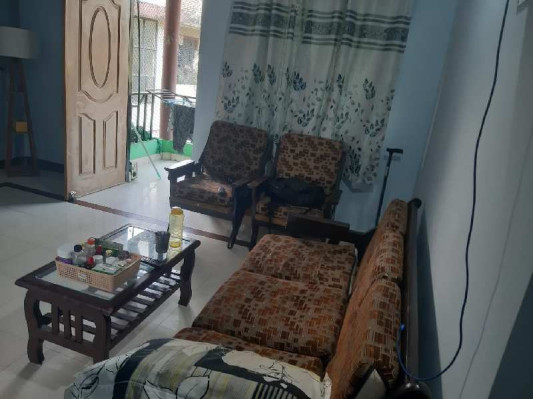
Locate an element on the screen. Image resolution: width=533 pixels, height=399 pixels. white lampshade is located at coordinates 21,41.